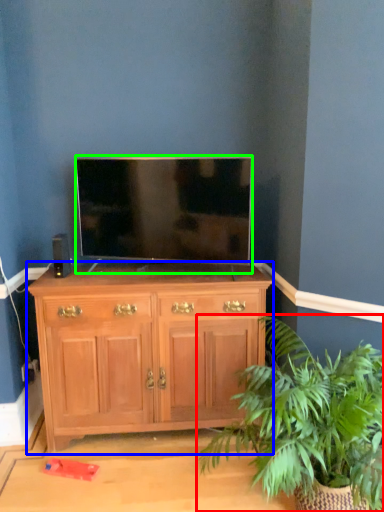
Question: Based on their relative distances, which object is nearer to houseplant (highlighted by a red box)? Choose from chest of drawers (highlighted by a blue box) and television (highlighted by a green box).

Choices:
 (A) chest of drawers
 (B) television

Answer: (A)